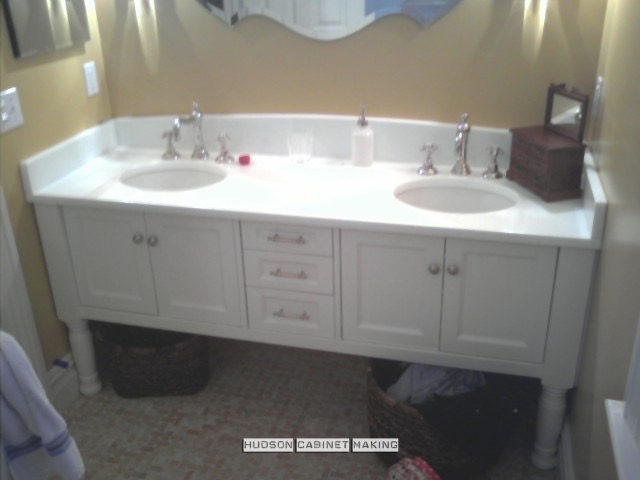
Image resolution: width=640 pixels, height=480 pixels. I want to click on tap, so click(x=175, y=128).